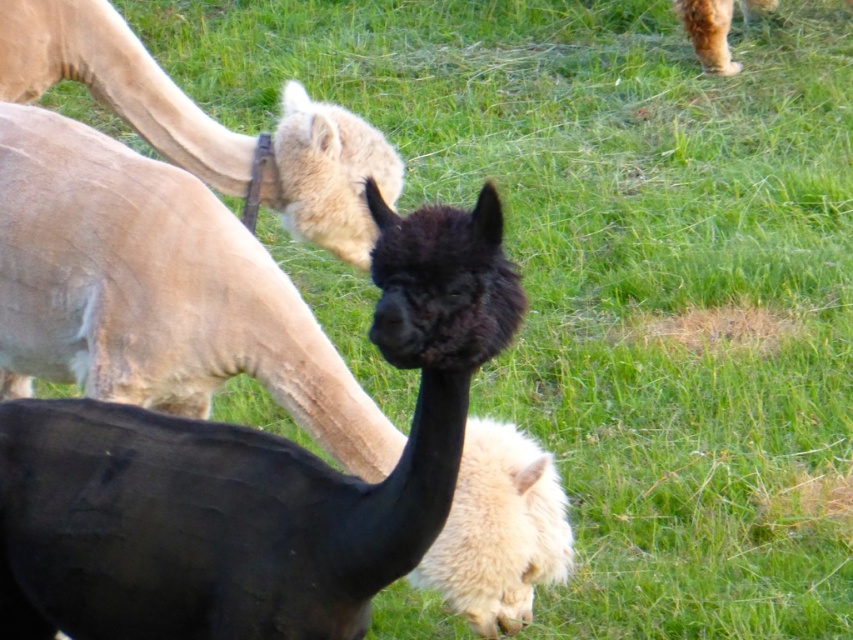
You are standing in the field and see two points marked in the image. The first point is at coordinate point [390,570] and the second is at point [20,3]. Which point is nearer to you?

Point [390,570] is closer to the viewer than point [20,3].

You are a farmer who needs to separate the black fuzzy alpaca at center from the light beige woolen camel at upper left. What is the minimum distance you need to move one of them to ensure they are at least 5 feet apart?

The current distance between the black fuzzy alpaca at center and the light beige woolen camel at upper left is 4.45 feet. To achieve a minimum of 5 feet apart, you need to move one of them by at least 0.55 feet.

You are a farmer who wants to build a fence around the black fuzzy alpaca at center and the light beige woolen camel at upper left. Which animal requires a taller fence to ensure it can comfortably stand without touching the top?

The black fuzzy alpaca at center requires a taller fence because it is much taller than the light beige woolen camel at upper left, so the fence must accommodate its height for comfort.